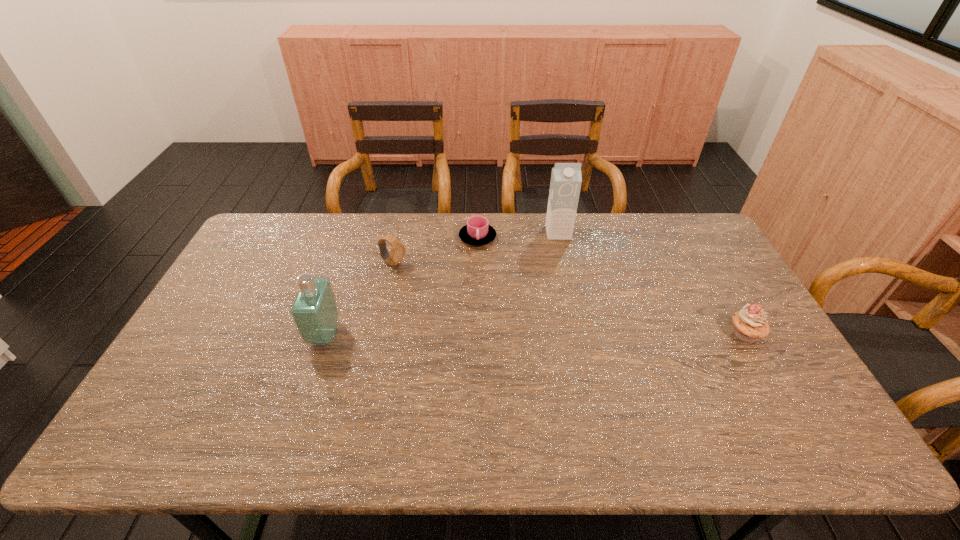
Identify the location of vacant space on the desktop that is between the leftmost object and the cupcake and is positioned on the face of the third farthest object. (542, 334).

This screenshot has height=540, width=960. I want to click on free space on the desktop that is between the leftmost object and the rightmost object and is positioned on the front label of the tallest object, so click(x=579, y=334).

Locate an element on the screen. free space on the desktop that is between the second tallest object and the cupcake and is positioned on the side with the handle of the cup is located at coordinates click(x=526, y=334).